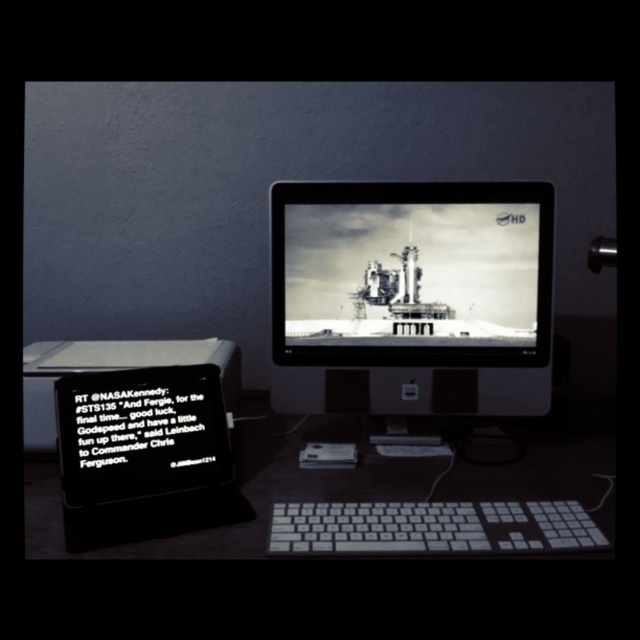
Which of these two, white plastic keyboard at center or black matte tablet at lower left, stands shorter?

With less height is white plastic keyboard at center.

Is white plastic keyboard at center bigger than black matte tablet at lower left?

Yes.

Which is behind, point (288, 420) or point (124, 458)?

The point (288, 420) is more distant.

Find the location of a particular element. This screenshot has height=640, width=640. white plastic keyboard at center is located at coordinates (292, 486).

Is black glossy monitor at center above white plastic keyboard at center?

Correct, black glossy monitor at center is located above white plastic keyboard at center.

Is point (472, 204) positioned after point (472, 472)?

Yes, point (472, 204) is behind point (472, 472).

The image size is (640, 640). Find the location of `black glossy monitor at center`. black glossy monitor at center is located at coordinates [412, 298].

Which is more to the left, black matte tablet at lower left or white plastic keyboard at lower center?

Positioned to the left is black matte tablet at lower left.

Who is more distant from viewer, (148, 403) or (472, 522)?

Point (148, 403)

I want to click on black matte tablet at lower left, so click(x=140, y=433).